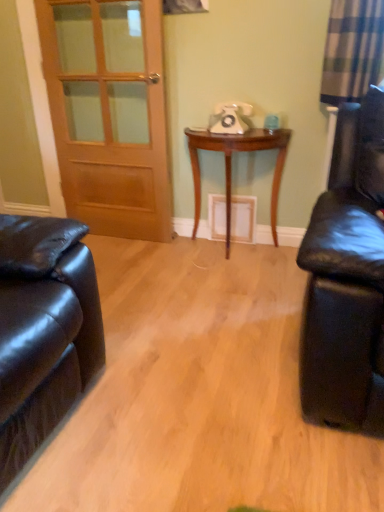
What do you see at coordinates (231, 166) in the screenshot?
I see `woodenmaterial/texturetable at center` at bounding box center [231, 166].

You are a GUI agent. You are given a task and a screenshot of the screen. Output one action in this format:
    pyautogui.click(x=<x>, y=<y>)
    Task: Click on the woodenmaterial/texturetable at center
    The width and height of the screenshot is (384, 512).
    Given the screenshot: What is the action you would take?
    pyautogui.click(x=231, y=166)

The width and height of the screenshot is (384, 512). I want to click on wooden door at left, so click(109, 113).

Measure the distance between wooden door at left and camera.

The depth of wooden door at left is 7.33 feet.

Consider the image. What is the approximate height of wooden door at left?

The height of wooden door at left is 1.40 meters.

What do you see at coordinates (109, 113) in the screenshot?
I see `wooden door at left` at bounding box center [109, 113].

Locate an element on the screen. woodenmaterial/texturetable at center is located at coordinates (231, 166).

Can you confirm if woodenmaterial/texturetable at center is positioned to the right of wooden door at left?

Indeed, woodenmaterial/texturetable at center is positioned on the right side of wooden door at left.

Considering their positions, is woodenmaterial/texturetable at center located in front of or behind wooden door at left?

woodenmaterial/texturetable at center is positioned closer to the viewer than wooden door at left.

Which is closer to the camera, [276,223] or [132,108]?

Point [276,223] is closer to the camera than point [132,108].

From the image's perspective, is woodenmaterial/texturetable at center below wooden door at left?

Yes, from the image's perspective, woodenmaterial/texturetable at center is below wooden door at left.

From a real-world perspective, between woodenmaterial/texturetable at center and wooden door at left, who is vertically lower?

In real-world perspective, woodenmaterial/texturetable at center is lower.

Between woodenmaterial/texturetable at center and wooden door at left, which one has larger width?

woodenmaterial/texturetable at center is wider.

Considering the sizes of objects woodenmaterial/texturetable at center and wooden door at left in the image provided, who is taller, woodenmaterial/texturetable at center or wooden door at left?

wooden door at left.

Based on their sizes in the image, would you say woodenmaterial/texturetable at center is bigger or smaller than wooden door at left?

Considering their sizes, woodenmaterial/texturetable at center takes up more space than wooden door at left.

Based on the photo, is woodenmaterial/texturetable at center positioned beyond the bounds of wooden door at left?

Indeed, woodenmaterial/texturetable at center is completely outside wooden door at left.

In the scene shown: Is woodenmaterial/texturetable at center positioned far away from wooden door at left?

No, woodenmaterial/texturetable at center is not far away from wooden door at left.

Is woodenmaterial/texturetable at center facing away from wooden door at left?

woodenmaterial/texturetable at center is not turned away from wooden door at left.

How distant is woodenmaterial/texturetable at center from wooden door at left?

A distance of 21.54 inches exists between woodenmaterial/texturetable at center and wooden door at left.

Find the location of a particular element. table that is on the right side of wooden door at left is located at coordinates (231, 166).

Considering the relative positions of wooden door at left and woodenmaterial/texturetable at center in the image provided, is wooden door at left to the left of woodenmaterial/texturetable at center from the viewer's perspective?

Yes, wooden door at left is to the left of woodenmaterial/texturetable at center.

Is wooden door at left positioned in front of woodenmaterial/texturetable at center?

No.

Does point (67, 46) lie behind point (197, 187)?

No.

From the image's perspective, is wooden door at left on woodenmaterial/texturetable at center?

Yes, from the image's perspective, wooden door at left is over woodenmaterial/texturetable at center.

From a real-world perspective, which object rests below the other?

woodenmaterial/texturetable at center, from a real-world perspective.

Considering the relative sizes of wooden door at left and woodenmaterial/texturetable at center in the image provided, is wooden door at left thinner than woodenmaterial/texturetable at center?

Yes.

Considering the sizes of wooden door at left and woodenmaterial/texturetable at center in the image, is wooden door at left taller or shorter than woodenmaterial/texturetable at center?

Considering their sizes, wooden door at left has more height than woodenmaterial/texturetable at center.

Which of these two, wooden door at left or woodenmaterial/texturetable at center, is bigger?

woodenmaterial/texturetable at center.

Is wooden door at left inside the boundaries of woodenmaterial/texturetable at center, or outside?

wooden door at left is not inside woodenmaterial/texturetable at center, it's outside.

Would you consider wooden door at left to be distant from woodenmaterial/texturetable at center?

Actually, wooden door at left and woodenmaterial/texturetable at center are a little close together.

Is wooden door at left oriented towards woodenmaterial/texturetable at center?

No, wooden door at left is not facing towards woodenmaterial/texturetable at center.

Can you tell me how much wooden door at left and woodenmaterial/texturetable at center differ in facing direction?

The facing directions of wooden door at left and woodenmaterial/texturetable at center are 0.342 degrees apart.

How much distance is there between wooden door at left and woodenmaterial/texturetable at center?

wooden door at left is 21.54 inches away from woodenmaterial/texturetable at center.

Find the location of a particular element. table that is below the wooden door at left (from the image's perspective) is located at coordinates (231, 166).

This screenshot has width=384, height=512. What are the coordinates of `table in front of the wooden door at left` in the screenshot? It's located at (231, 166).

In order to click on table below the wooden door at left (from a real-world perspective) in this screenshot , I will do `click(231, 166)`.